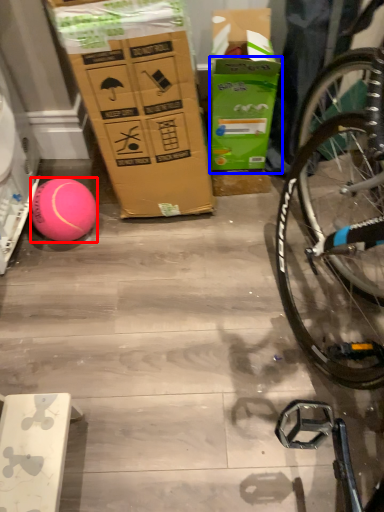
Question: Which object appears farthest to the camera in this image, ball (highlighted by a red box) or cardboard box (highlighted by a blue box)?

Choices:
 (A) ball
 (B) cardboard box

Answer: (A)